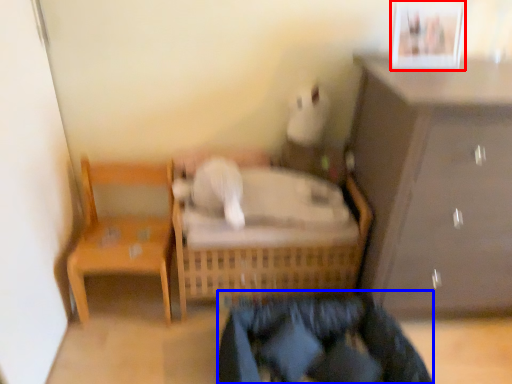
Question: Which point is further to the camera, picture frame (highlighted by a red box) or clothing (highlighted by a blue box)?

Choices:
 (A) picture frame
 (B) clothing

Answer: (A)